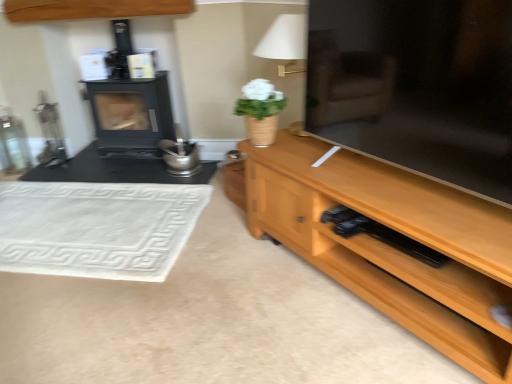
The height and width of the screenshot is (384, 512). Identify the location of empty space that is ontop of white woven mat at lower left (from a real-world perspective). (111, 205).